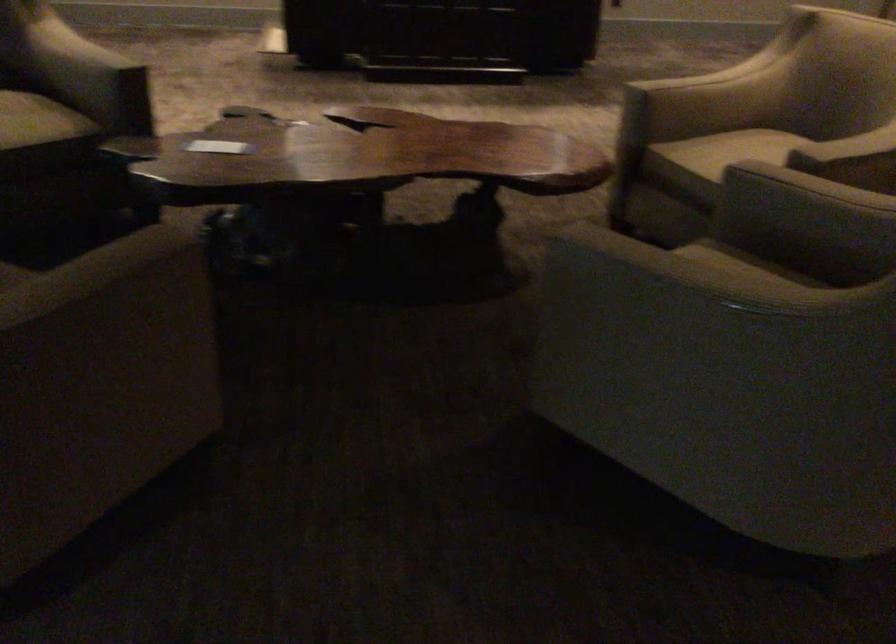
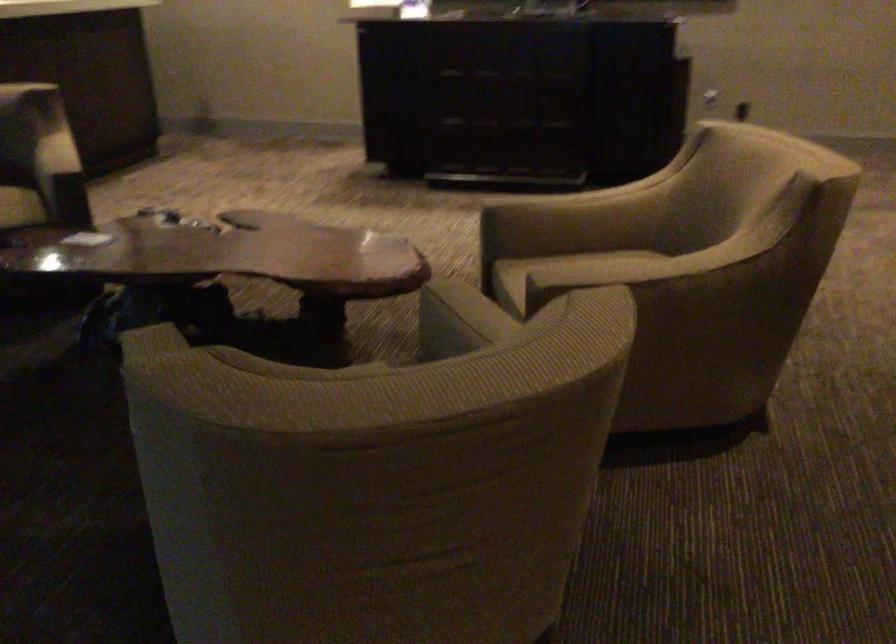
Question: I am providing you with two images of the same scene from different viewpoints. Please identify which objects are invisible in image2.

Choices:
 (A) chair armrest
 (B) upholstered chair armrest
 (C) chair sitting surface
 (D) black ergonomic mouse

Answer: (A)